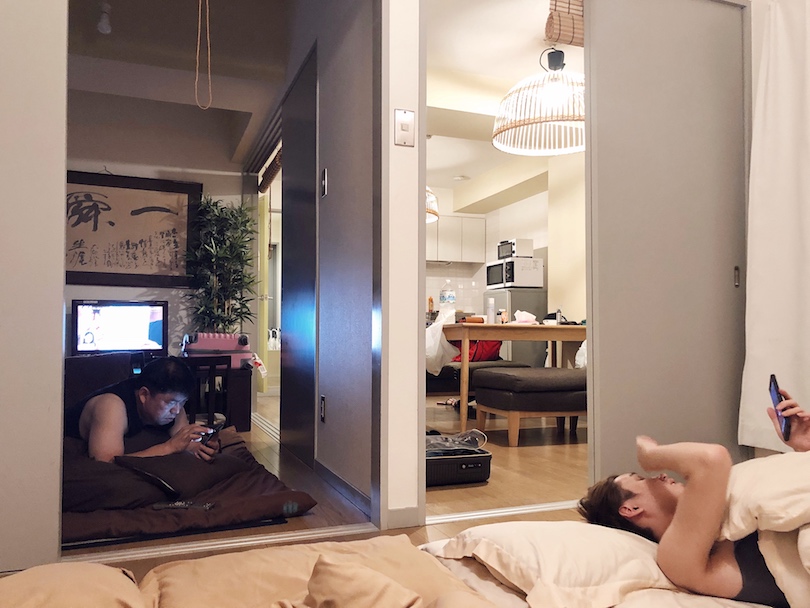
Identify the location of beds. (685, 598), (231, 578), (233, 491).